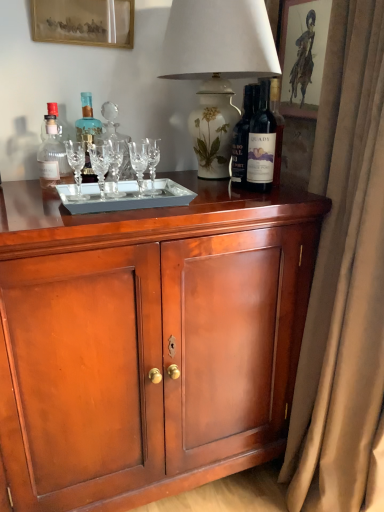
Question: In which direction should I rotate to look at blue glass bottle at center, which is the 2th bottle from right to left?

Choices:
 (A) right
 (B) left

Answer: (B)

Question: Considering the relative positions of beige velvet curtain at right and white floral vase at upper center in the image provided, is beige velvet curtain at right to the left of white floral vase at upper center from the viewer's perspective?

Choices:
 (A) yes
 (B) no

Answer: (B)

Question: From a real-world perspective, is beige velvet curtain at right located higher than white floral vase at upper center?

Choices:
 (A) no
 (B) yes

Answer: (A)

Question: Can you confirm if beige velvet curtain at right is thinner than white floral vase at upper center?

Choices:
 (A) no
 (B) yes

Answer: (B)

Question: From a real-world perspective, is beige velvet curtain at right below white floral vase at upper center?

Choices:
 (A) yes
 (B) no

Answer: (A)

Question: Can you confirm if beige velvet curtain at right is shorter than white floral vase at upper center?

Choices:
 (A) no
 (B) yes

Answer: (A)

Question: Considering the relative positions of beige velvet curtain at right and white floral vase at upper center in the image provided, is beige velvet curtain at right to the right of white floral vase at upper center from the viewer's perspective?

Choices:
 (A) yes
 (B) no

Answer: (A)

Question: Considering the relative positions of blue glass bottle at center, which is the 2th bottle from right to left, and gold-framed picture at upper left, marked as the first picture frame in a left-to-right arrangement, in the image provided, is blue glass bottle at center, which is the 2th bottle from right to left, to the right of gold-framed picture at upper left, marked as the first picture frame in a left-to-right arrangement, from the viewer's perspective?

Choices:
 (A) no
 (B) yes

Answer: (B)

Question: Does blue glass bottle at center, positioned as the second bottle in left-to-right order, turn towards gold-framed picture at upper left, marked as the first picture frame in a left-to-right arrangement?

Choices:
 (A) yes
 (B) no

Answer: (B)

Question: Can you confirm if blue glass bottle at center, which is the 2th bottle from right to left, is thinner than gold-framed picture at upper left, which appears as the second picture frame when viewed from the right?

Choices:
 (A) no
 (B) yes

Answer: (A)

Question: Would you consider blue glass bottle at center, positioned as the second bottle in left-to-right order, to be distant from gold-framed picture at upper left, marked as the first picture frame in a left-to-right arrangement?

Choices:
 (A) yes
 (B) no

Answer: (B)

Question: Can you confirm if blue glass bottle at center, positioned as the second bottle in left-to-right order, is taller than gold-framed picture at upper left, marked as the first picture frame in a left-to-right arrangement?

Choices:
 (A) no
 (B) yes

Answer: (B)

Question: From the image's perspective, is blue glass bottle at center, positioned as the second bottle in left-to-right order, on top of gold-framed picture at upper left, which appears as the second picture frame when viewed from the right?

Choices:
 (A) yes
 (B) no

Answer: (B)

Question: Does white floral vase at upper center touch gold-framed picture at upper left, which appears as the second picture frame when viewed from the right?

Choices:
 (A) yes
 (B) no

Answer: (B)